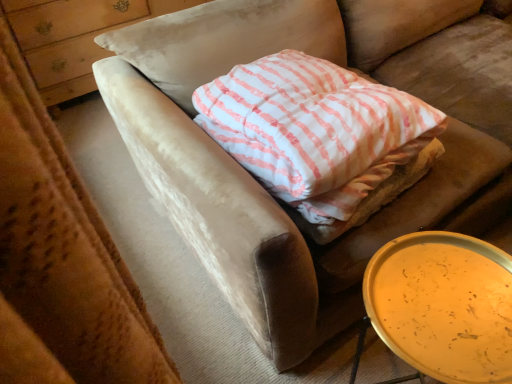
Question: Considering the positions of point (33, 61) and point (432, 284), is point (33, 61) closer or farther from the camera than point (432, 284)?

Choices:
 (A) closer
 (B) farther

Answer: (B)

Question: From the image's perspective, is wooden dresser at upper left positioned above or below metallic gold tray at lower right?

Choices:
 (A) below
 (B) above

Answer: (B)

Question: Considering the real-world distances, which object is closest to the metallic gold tray at lower right?

Choices:
 (A) white striped fabric pillow at center
 (B) wooden dresser at upper left

Answer: (A)

Question: Considering the real-world distances, which object is closest to the wooden dresser at upper left?

Choices:
 (A) white striped fabric pillow at center
 (B) metallic gold tray at lower right

Answer: (A)